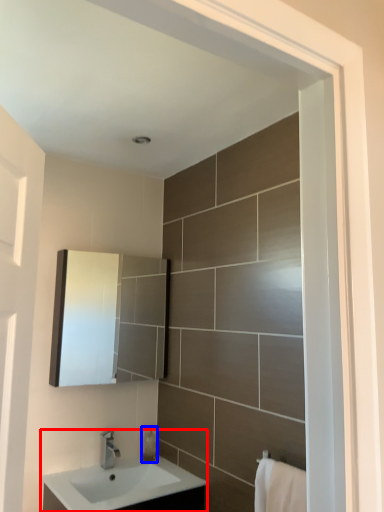
Question: Which of the following is the closest to the observer, sink (highlighted by a red box) or soap dispenser (highlighted by a blue box)?

Choices:
 (A) sink
 (B) soap dispenser

Answer: (A)